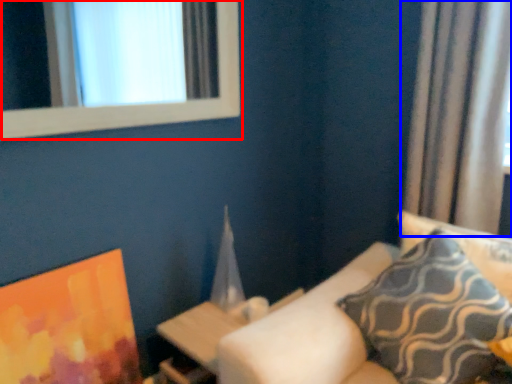
Question: Which object appears farthest to the camera in this image, window (highlighted by a red box) or curtain (highlighted by a blue box)?

Choices:
 (A) window
 (B) curtain

Answer: (B)